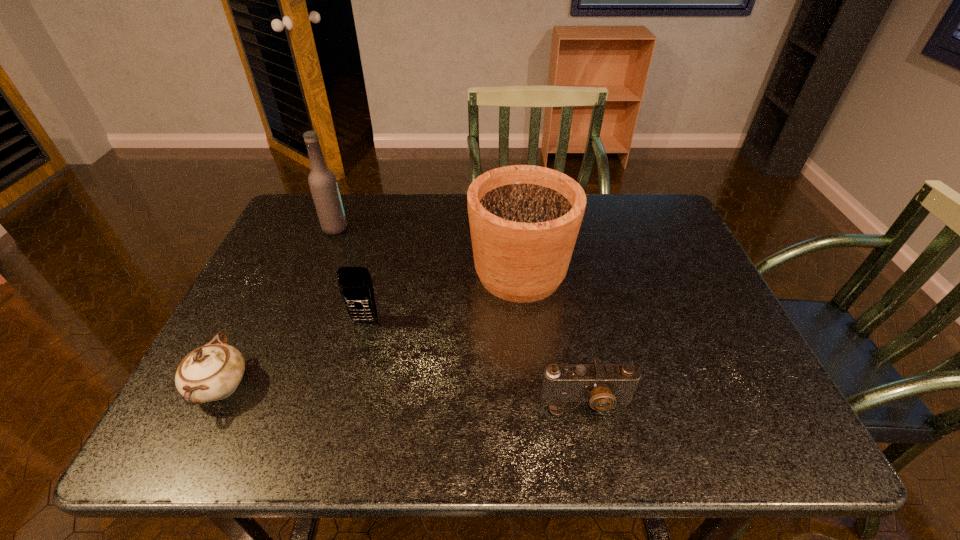
Locate an element on the screen. The width and height of the screenshot is (960, 540). vacant space located 0.280m on the front of the flowerpot is located at coordinates (534, 417).

I want to click on free spot located on the screen of the third nearest object, so click(352, 368).

Locate an element on the screen. The image size is (960, 540). vacant space located on the right of the chinaware is located at coordinates (396, 387).

The image size is (960, 540). What are the coordinates of `object that is at the far edge` in the screenshot? It's located at (322, 181).

In order to click on chinaware located at the near edge in this screenshot , I will do `click(212, 372)`.

Find the location of `camera situated at the near edge`. camera situated at the near edge is located at coordinates (602, 385).

Find the location of `beer bottle present at the left edge`. beer bottle present at the left edge is located at coordinates (322, 181).

In order to click on chinaware at the left edge in this screenshot , I will do `click(212, 372)`.

Where is `object located at the far left corner`? object located at the far left corner is located at coordinates (322, 181).

I want to click on object at the near left corner, so point(212,372).